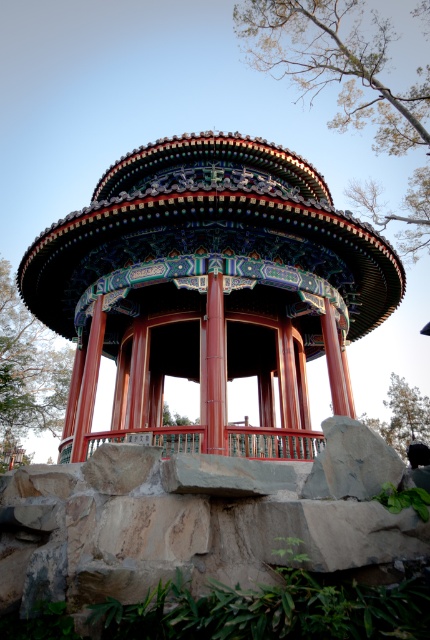
Question: Among these objects, which one is nearest to the camera?

Choices:
 (A) green leafy tree at lower left
 (B) green leafy tree at lower right
 (C) polished wood gazebo at center

Answer: (C)

Question: Does polished wood gazebo at center have a larger size compared to green leafy tree at lower left?

Choices:
 (A) no
 (B) yes

Answer: (B)

Question: Does polished wood gazebo at center have a greater width compared to green leafy tree at upper center?

Choices:
 (A) no
 (B) yes

Answer: (A)

Question: Can you confirm if polished wood gazebo at center is wider than green leafy tree at upper center?

Choices:
 (A) no
 (B) yes

Answer: (A)

Question: Estimate the real-world distances between objects in this image. Which object is farther from the polished wood gazebo at center?

Choices:
 (A) green leafy tree at lower left
 (B) green leafy tree at lower right

Answer: (B)

Question: Which of these objects is positioned closest to the green leafy tree at lower right?

Choices:
 (A) polished wood gazebo at center
 (B) green leafy tree at lower left
 (C) green leafy tree at upper center

Answer: (C)